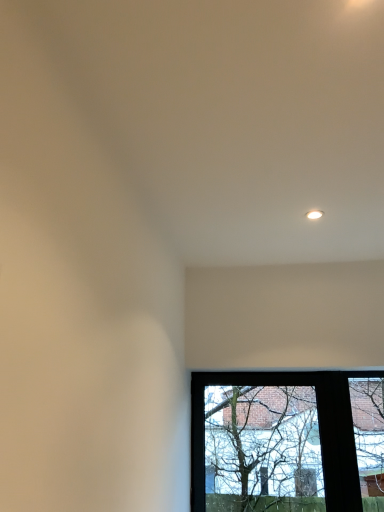
The height and width of the screenshot is (512, 384). Find the location of `transparent glass window at lower right`. transparent glass window at lower right is located at coordinates (287, 441).

Measure the distance between point (241, 450) and camera.

Point (241, 450) and camera are 2.59 meters apart.

This screenshot has width=384, height=512. What do you see at coordinates (287, 441) in the screenshot? I see `transparent glass window at lower right` at bounding box center [287, 441].

Locate an element on the screen. The height and width of the screenshot is (512, 384). transparent glass window at lower right is located at coordinates (287, 441).